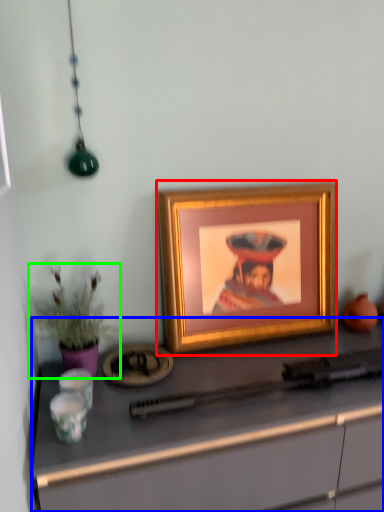
Question: Which is nearer to the picture frame (highlighted by a red box)? desk (highlighted by a blue box) or houseplant (highlighted by a green box).

Choices:
 (A) desk
 (B) houseplant

Answer: (A)